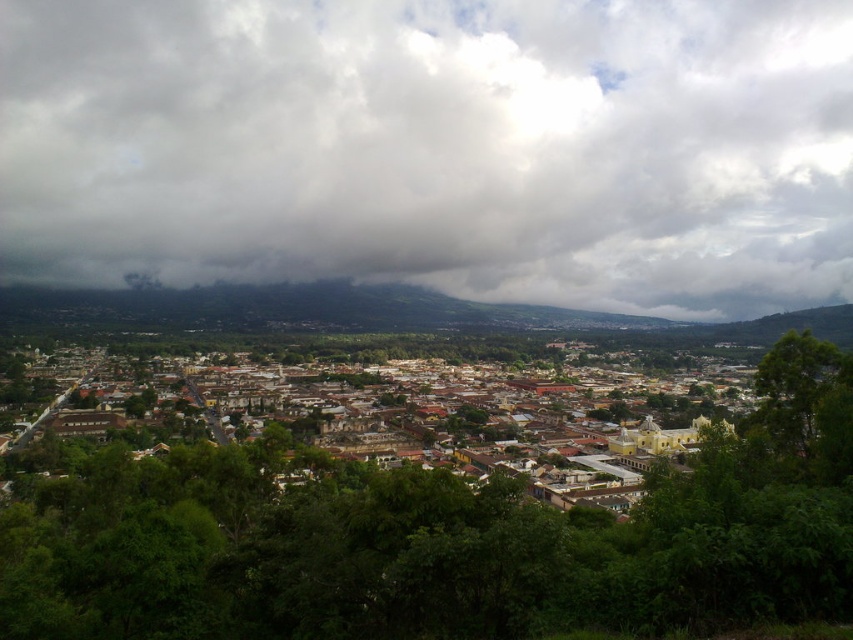
Is white fluffy cloud at upper center smaller than brown/weathered stone town at center?

Correct, white fluffy cloud at upper center occupies less space than brown/weathered stone town at center.

Which is above, white fluffy cloud at upper center or brown/weathered stone town at center?

Positioned higher is white fluffy cloud at upper center.

Find the location of `white fluffy cloud at upper center`. white fluffy cloud at upper center is located at coordinates (434, 148).

Locate an element on the screen. The height and width of the screenshot is (640, 853). white fluffy cloud at upper center is located at coordinates (434, 148).